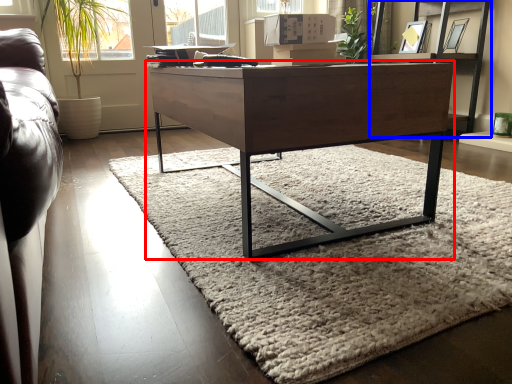
Question: Which of the following is the farthest to the observer, desk (highlighted by a red box) or shelf (highlighted by a blue box)?

Choices:
 (A) desk
 (B) shelf

Answer: (B)